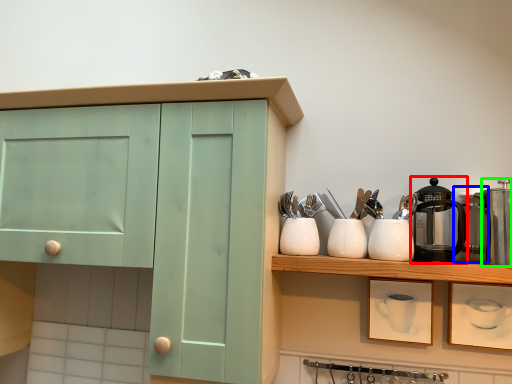
Question: Which is farther away from coffeepot (highlighted by a red box)? appliance (highlighted by a blue box) or appliance (highlighted by a green box)?

Choices:
 (A) appliance
 (B) appliance

Answer: (B)